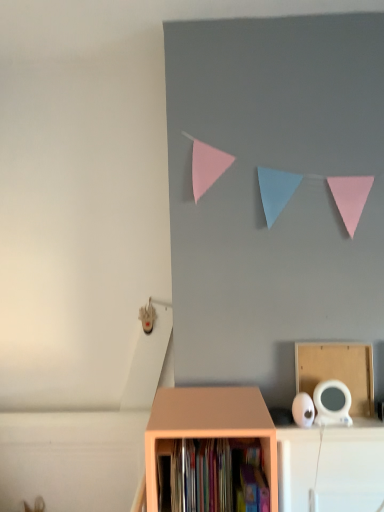
Question: Considering the positions of cardboard at upper right and hardcover books at center in the image, is cardboard at upper right wider or thinner than hardcover books at center?

Choices:
 (A) thin
 (B) wide

Answer: (A)

Question: From the image's perspective, is cardboard at upper right positioned above or below hardcover books at center?

Choices:
 (A) below
 (B) above

Answer: (B)

Question: Which object is positioned closest to the matte wood shelf at lower center?

Choices:
 (A) cardboard at upper right
 (B) hardcover books at center

Answer: (B)

Question: Considering the real-world distances, which object is closest to the cardboard at upper right?

Choices:
 (A) matte wood shelf at lower center
 (B) hardcover books at center

Answer: (A)